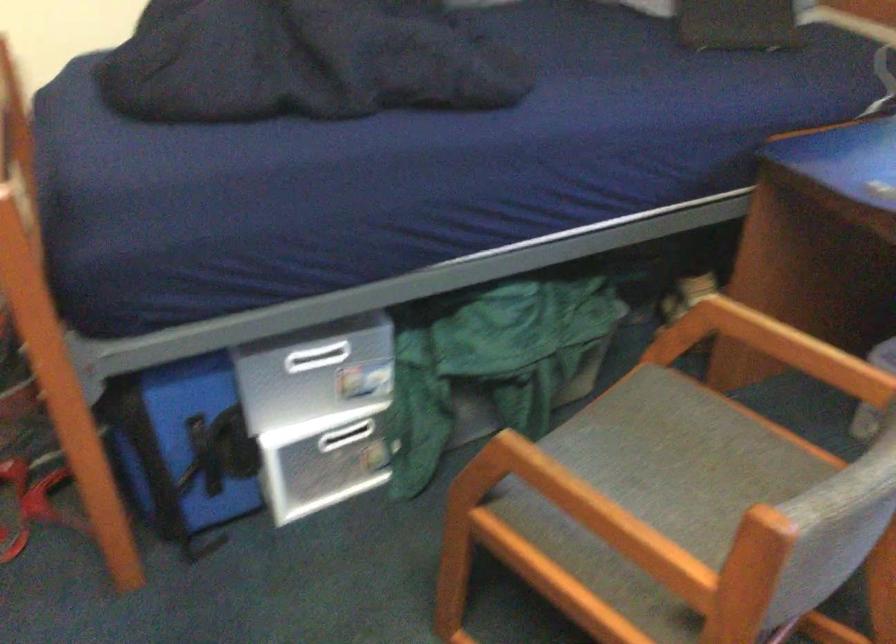
Where is `chair sitting surface`? Image resolution: width=896 pixels, height=644 pixels. chair sitting surface is located at coordinates (677, 453).